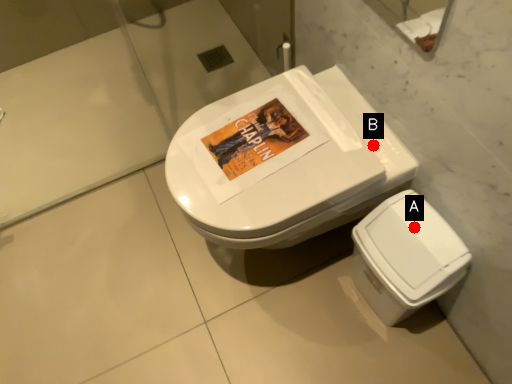
Question: Two points are circled on the image, labeled by A and B beside each circle. Which point is closer to the camera?

Choices:
 (A) A is closer
 (B) B is closer

Answer: (A)